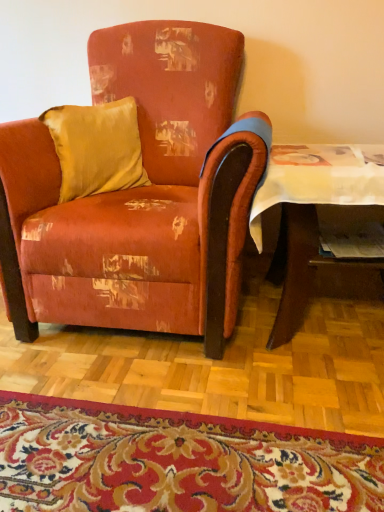
The width and height of the screenshot is (384, 512). Identify the location of empty space that is ontop of carpet with floral pattern at lower center. (158, 454).